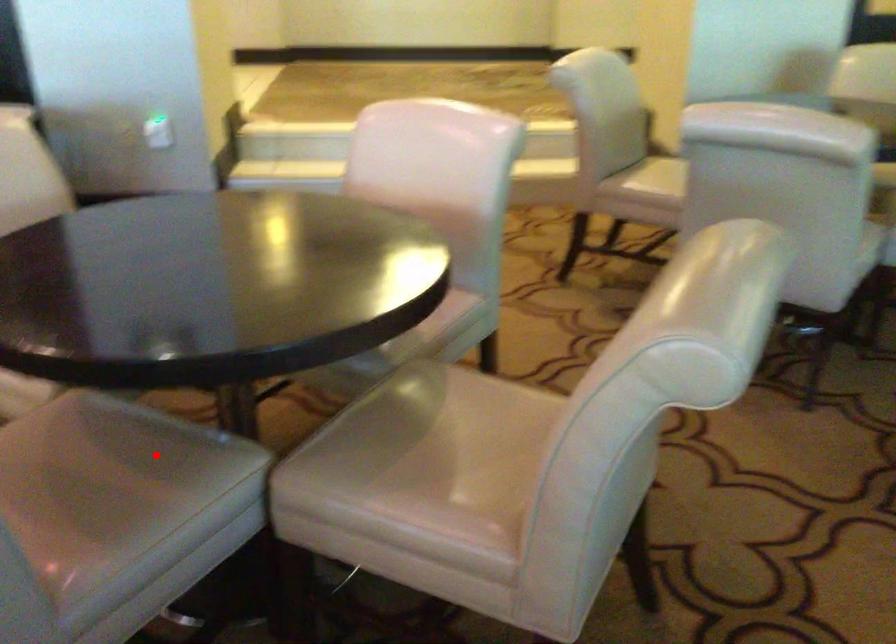
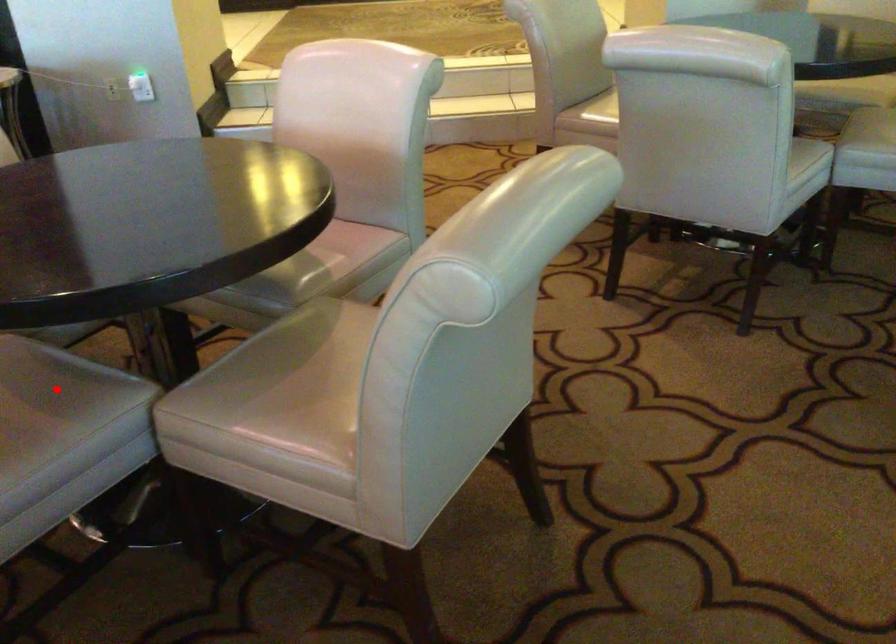
I am providing you with two images of the same scene from different viewpoints. A red point is marked on the first image and another point is marked on the second image. Do the highlighted points in image1 and image2 indicate the same real-world spot?

Yes